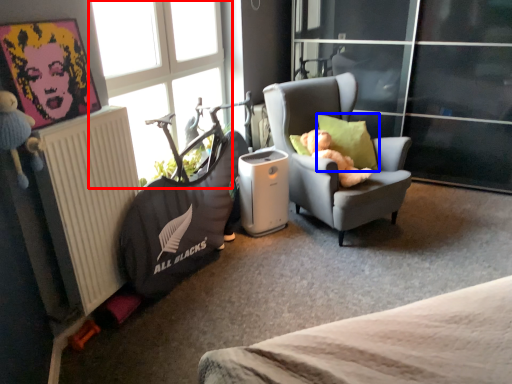
Question: Which object appears farthest to the camera in this image, window (highlighted by a red box) or pillow (highlighted by a blue box)?

Choices:
 (A) window
 (B) pillow

Answer: (B)